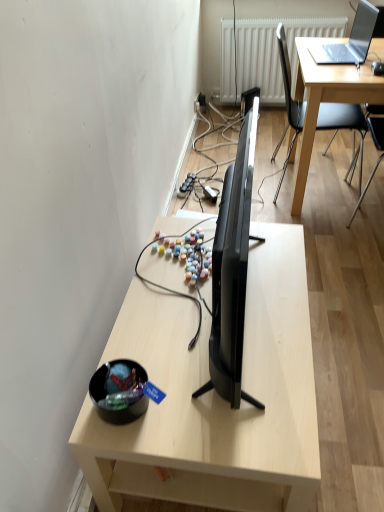
Image resolution: width=384 pixels, height=512 pixels. Find the location of `vacant point to the right of light wood desk at center`. vacant point to the right of light wood desk at center is located at coordinates (347, 362).